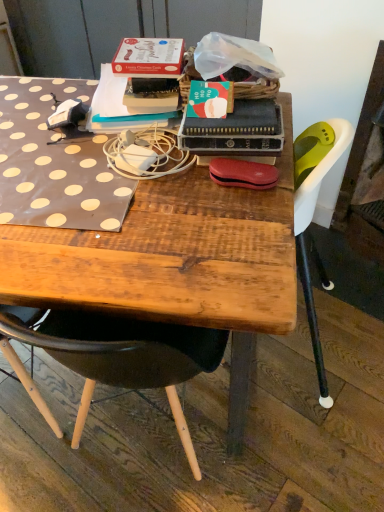
Locate an element on the screen. This screenshot has height=512, width=384. matte red pouch at center is located at coordinates (243, 173).

Identify the location of wooden desk at center. This screenshot has height=512, width=384. (171, 254).

What do you see at coordinates (236, 131) in the screenshot? This screenshot has height=512, width=384. I see `hardcover book at center` at bounding box center [236, 131].

You are a GUI agent. You are given a task and a screenshot of the screen. Output one action in this format:
    pyautogui.click(x=<x>, y=<y>)
    Task: Click on the white matte charger at center
    This screenshot has height=512, width=384.
    Given the screenshot: What is the action you would take?
    pyautogui.click(x=146, y=154)

Between matte red pouch at center and hardcover book at center, which one has larger size?

hardcover book at center.

From the image's perspective, does matte red pouch at center appear higher than hardcover book at center?

Answer: No, from the image's perspective, matte red pouch at center is not above hardcover book at center.

Is matte red pouch at center wider than hardcover book at center?

No, matte red pouch at center is not wider than hardcover book at center.

Looking at this image, considering the relative positions of hardcover book at center and matte red pouch at center in the image provided, is hardcover book at center to the left or to the right of matte red pouch at center?

Based on their positions, hardcover book at center is located to the left of matte red pouch at center.

Is hardcover book at center positioned with its back to matte red pouch at center?

That's not correct — hardcover book at center is not looking away from matte red pouch at center.

Can you confirm if hardcover book at center is bigger than matte red pouch at center?

Yes, hardcover book at center is bigger than matte red pouch at center.

Is hardcover book at center inside or outside of matte red pouch at center?

hardcover book at center is not inside matte red pouch at center, it's outside.

Which object is closer to the camera taking this photo, white matte charger at center or hardcover book at center?

Positioned in front is hardcover book at center.

Considering the sizes of objects white matte charger at center and hardcover book at center in the image provided, who is thinner, white matte charger at center or hardcover book at center?

hardcover book at center.

From a real-world perspective, is white matte charger at center physically located above or below hardcover book at center?

In terms of real-world spatial position, white matte charger at center is below hardcover book at center.

Is white matte charger at center oriented towards hardcover book at center?

No.

Is wooden desk at center situated inside white matte charger at center or outside?

wooden desk at center lies outside white matte charger at center.

Is point (44, 256) farther from camera compared to point (107, 149)?

No.

Is wooden desk at center facing away from white matte charger at center?

wooden desk at center is not turned away from white matte charger at center.

The image size is (384, 512). I want to click on desk in front of the white matte charger at center, so click(x=171, y=254).

From a real-world perspective, which is physically above, wooden desk at center or hardcover book at center?

hardcover book at center.

In terms of height, does wooden desk at center look taller or shorter compared to hardcover book at center?

In the image, wooden desk at center appears to be taller than hardcover book at center.

Find the location of a particular element. The image size is (384, 512). desk on the left of hardcover book at center is located at coordinates (171, 254).

From a real-world perspective, which object stands above the other?

In real-world perspective, matte red pouch at center is above.

Which object is closer to the camera taking this photo, wooden desk at center or matte red pouch at center?

wooden desk at center is in front.

Which is more to the left, wooden desk at center or matte red pouch at center?

From the viewer's perspective, wooden desk at center appears more on the left side.

Would you say matte red pouch at center is part of wooden desk at center's contents?

No.

Between white matte charger at center and wooden desk at center, which one has less height?

With less height is white matte charger at center.

Is white matte charger at center turned away from wooden desk at center?

white matte charger at center is not turned away from wooden desk at center.

Is white matte charger at center positioned far away from wooden desk at center?

Actually, white matte charger at center and wooden desk at center are a little close together.

Find the location of a particular element. The image size is (384, 512). handbag located behind the hardcover book at center is located at coordinates (243, 173).

There is a matte red pouch at center. Identify the location of paperback book above it (from a real-world perspective). (236, 131).

Considering their positions, is white matte charger at center positioned closer to matte red pouch at center than hardcover book at center?

hardcover book at center lies closer to matte red pouch at center than the other object.

Estimate the real-world distances between objects in this image. Which object is further from hardcover book at center, wooden desk at center or matte red pouch at center?

wooden desk at center is positioned further to the anchor hardcover book at center.

Based on their spatial positions, is white matte charger at center or wooden desk at center closer to matte red pouch at center?

Among the two, white matte charger at center is located nearer to matte red pouch at center.

From the image, which object appears to be farther from wooden desk at center, white matte charger at center or hardcover book at center?

Based on the image, hardcover book at center appears to be further to wooden desk at center.

Based on their spatial positions, is matte red pouch at center or wooden desk at center further from white matte charger at center?

The object further to white matte charger at center is wooden desk at center.

Which object lies nearer to the anchor point matte red pouch at center, wooden desk at center or hardcover book at center?

hardcover book at center is closer to matte red pouch at center.

Based on their spatial positions, is hardcover book at center or white matte charger at center further from matte red pouch at center?

white matte charger at center is positioned further to the anchor matte red pouch at center.

Estimate the real-world distances between objects in this image. Which object is further from white matte charger at center, matte red pouch at center or hardcover book at center?

matte red pouch at center is positioned further to the anchor white matte charger at center.

Image resolution: width=384 pixels, height=512 pixels. I want to click on paperback book between white matte charger at center and matte red pouch at center in the horizontal direction, so click(236, 131).

Locate an element on the screen. The height and width of the screenshot is (512, 384). string between wooden desk at center and hardcover book at center from left to right is located at coordinates (146, 154).

Locate an element on the screen. This screenshot has width=384, height=512. paperback book situated between wooden desk at center and matte red pouch at center from left to right is located at coordinates (236, 131).

Where is `string between wooden desk at center and matte red pouch at center from left to right`? Image resolution: width=384 pixels, height=512 pixels. string between wooden desk at center and matte red pouch at center from left to right is located at coordinates (146, 154).